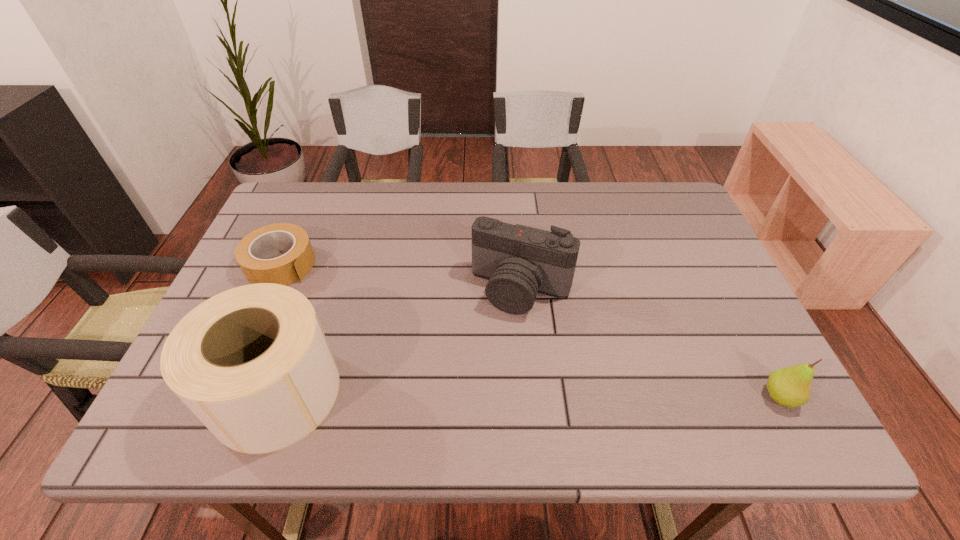
I want to click on object that is the closest to the toilet tissue, so click(251, 251).

Select which object is the third closest to the second shortest object. Please provide its 2D coordinates. Your answer should be formatted as a tuple, i.e. [(x, y)], where the tuple contains the x and y coordinates of a point satisfying the conditions above.

[(251, 251)]

Locate an element on the screen. vacant space that satisfies the following two spatial constraints: 1. on the front side of the camera; 2. on the left side of the shortest object is located at coordinates (270, 289).

Where is `vacant region that satisfies the following two spatial constraints: 1. on the front side of the toilet tissue; 2. on the left side of the third tallest object`? vacant region that satisfies the following two spatial constraints: 1. on the front side of the toilet tissue; 2. on the left side of the third tallest object is located at coordinates (276, 396).

The image size is (960, 540). In order to click on free space that satisfies the following two spatial constraints: 1. on the front side of the second shortest object; 2. on the right side of the toilet tissue in this screenshot , I will do `click(276, 396)`.

Where is `free spot that satisfies the following two spatial constraints: 1. on the back side of the toilet tissue; 2. on the left side of the second object from right to left`? This screenshot has height=540, width=960. free spot that satisfies the following two spatial constraints: 1. on the back side of the toilet tissue; 2. on the left side of the second object from right to left is located at coordinates (313, 289).